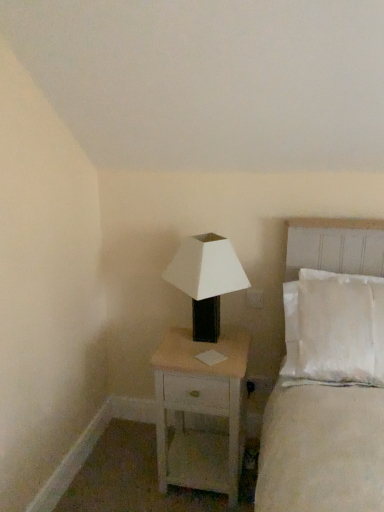
Question: From a real-world perspective, is white matte/black textured lamp at center under white cotton bed at right?

Choices:
 (A) yes
 (B) no

Answer: (B)

Question: Is white matte/black textured lamp at center to the left of white cotton bed at right from the viewer's perspective?

Choices:
 (A) no
 (B) yes

Answer: (B)

Question: Could you tell me if white matte/black textured lamp at center is turned towards white cotton bed at right?

Choices:
 (A) yes
 (B) no

Answer: (B)

Question: Is white matte/black textured lamp at center wider than white cotton bed at right?

Choices:
 (A) no
 (B) yes

Answer: (A)

Question: Is white matte/black textured lamp at center further to camera compared to white cotton bed at right?

Choices:
 (A) no
 (B) yes

Answer: (B)

Question: From the image's perspective, relative to white cotton bed at right, is white matte/black textured lamp at center above or below?

Choices:
 (A) below
 (B) above

Answer: (B)

Question: Is white matte/black textured lamp at center inside or outside of white cotton bed at right?

Choices:
 (A) inside
 (B) outside

Answer: (B)

Question: From a real-world perspective, is white matte/black textured lamp at center physically located above or below white cotton bed at right?

Choices:
 (A) above
 (B) below

Answer: (A)

Question: Considering the positions of white matte/black textured lamp at center and white cotton bed at right in the image, is white matte/black textured lamp at center wider or thinner than white cotton bed at right?

Choices:
 (A) wide
 (B) thin

Answer: (B)

Question: Is white wood nightstand at center bigger or smaller than white matte/black textured lamp at center?

Choices:
 (A) small
 (B) big

Answer: (B)

Question: Would you say white wood nightstand at center is inside or outside white matte/black textured lamp at center?

Choices:
 (A) outside
 (B) inside

Answer: (A)

Question: From a real-world perspective, relative to white matte/black textured lamp at center, is white wood nightstand at center vertically above or below?

Choices:
 (A) below
 (B) above

Answer: (A)

Question: Does point (211, 478) appear closer or farther from the camera than point (193, 282)?

Choices:
 (A) closer
 (B) farther

Answer: (B)

Question: From a real-world perspective, is white cotton bed at right physically located above or below white wood nightstand at center?

Choices:
 (A) below
 (B) above

Answer: (B)

Question: Considering their positions, is white cotton bed at right located in front of or behind white wood nightstand at center?

Choices:
 (A) behind
 (B) front

Answer: (B)